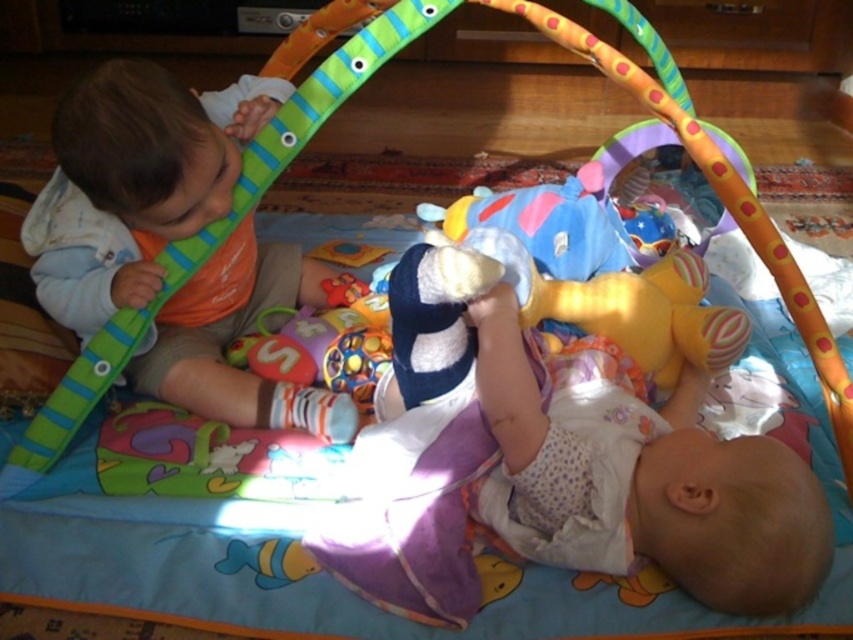
Is matte orange bib at left smaller than white soft baby at lower right?

Incorrect, matte orange bib at left is not smaller in size than white soft baby at lower right.

The image size is (853, 640). Describe the element at coordinates (132, 182) in the screenshot. I see `matte orange bib at left` at that location.

What are the coordinates of `matte orange bib at left` in the screenshot? It's located at (132, 182).